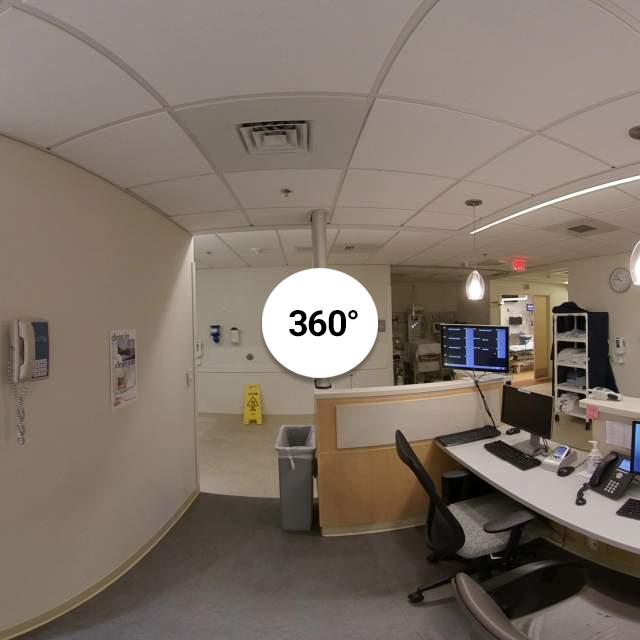
Locate an element on the screen. The width and height of the screenshot is (640, 640). office chair is located at coordinates (472, 522), (573, 614).